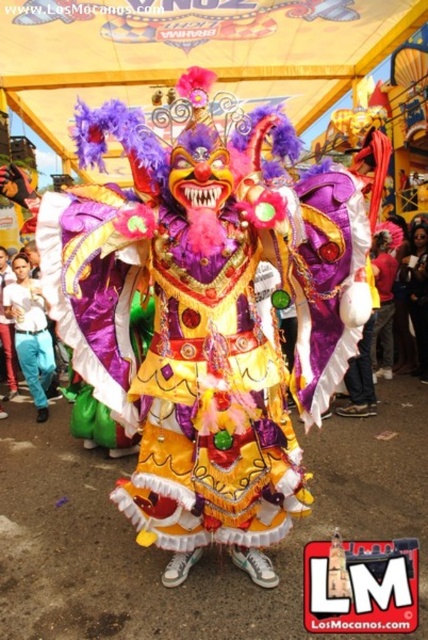
Which is behind, point (14, 291) or point (380, 230)?

The point (380, 230) is more distant.

Measure the distance from white cotton shirt at lower left to matte purple costume at center.

white cotton shirt at lower left is 2.87 meters from matte purple costume at center.

Does point (35, 400) come farther from viewer compared to point (376, 248)?

No, it is in front of (376, 248).

Locate an element on the screen. Image resolution: width=428 pixels, height=640 pixels. white cotton shirt at lower left is located at coordinates (30, 332).